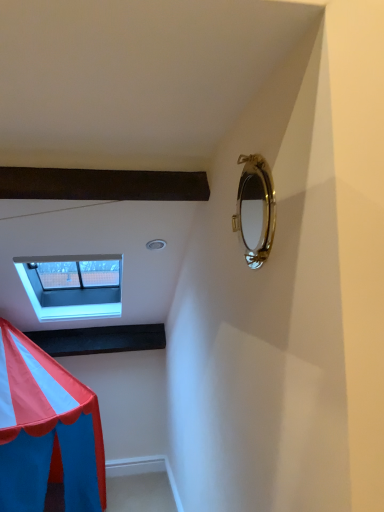
This screenshot has width=384, height=512. I want to click on white plastic window at upper left, so click(72, 286).

Describe the element at coordinates (72, 286) in the screenshot. I see `white plastic window at upper left` at that location.

What is the approximate height of white plastic window at upper left?

21.25 inches.

The image size is (384, 512). In order to click on gold metallic mirror at upper right in this screenshot , I will do `click(255, 209)`.

This screenshot has height=512, width=384. What do you see at coordinates (255, 209) in the screenshot?
I see `gold metallic mirror at upper right` at bounding box center [255, 209].

Locate an element on the screen. Image resolution: width=384 pixels, height=512 pixels. white plastic window at upper left is located at coordinates point(72,286).

Considering the positions of objects gold metallic mirror at upper right and white plastic window at upper left in the image provided, who is more to the right, gold metallic mirror at upper right or white plastic window at upper left?

From the viewer's perspective, gold metallic mirror at upper right appears more on the right side.

Is gold metallic mirror at upper right further to the viewer compared to white plastic window at upper left?

No, the depth of gold metallic mirror at upper right is less than that of white plastic window at upper left.

Does point (269, 220) lie behind point (64, 306)?

No, (269, 220) is in front of (64, 306).

From the image's perspective, is gold metallic mirror at upper right on top of white plastic window at upper left?

Yes, from the image's perspective, gold metallic mirror at upper right is over white plastic window at upper left.

From a real-world perspective, who is located lower, gold metallic mirror at upper right or white plastic window at upper left?

white plastic window at upper left.

Which object is thinner, gold metallic mirror at upper right or white plastic window at upper left?

gold metallic mirror at upper right is thinner.

Between gold metallic mirror at upper right and white plastic window at upper left, which one has less height?

gold metallic mirror at upper right is shorter.

Considering the relative sizes of gold metallic mirror at upper right and white plastic window at upper left in the image provided, is gold metallic mirror at upper right smaller than white plastic window at upper left?

Yes, gold metallic mirror at upper right is smaller than white plastic window at upper left.

Is gold metallic mirror at upper right inside or outside of white plastic window at upper left?

gold metallic mirror at upper right is located beyond the bounds of white plastic window at upper left.

Is there a large distance between gold metallic mirror at upper right and white plastic window at upper left?

gold metallic mirror at upper right is far away from white plastic window at upper left.

Is gold metallic mirror at upper right oriented towards white plastic window at upper left?

No.

The height and width of the screenshot is (512, 384). In order to click on mirror positioned vertically above the white plastic window at upper left (from a real-world perspective) in this screenshot , I will do `click(255, 209)`.

Which is more to the left, white plastic window at upper left or gold metallic mirror at upper right?

white plastic window at upper left.

Based on the photo, is white plastic window at upper left in front of or behind gold metallic mirror at upper right in the image?

Visually, white plastic window at upper left is located behind gold metallic mirror at upper right.

Considering the positions of points (47, 288) and (264, 201), is point (47, 288) closer to camera compared to point (264, 201)?

No, it is behind (264, 201).

From the image's perspective, is white plastic window at upper left located above or below gold metallic mirror at upper right?

white plastic window at upper left is below gold metallic mirror at upper right.

In the scene shown: From a real-world perspective, is white plastic window at upper left physically above gold metallic mirror at upper right?

Actually, white plastic window at upper left is physically below gold metallic mirror at upper right in the real world.

Which of these two, white plastic window at upper left or gold metallic mirror at upper right, is wider?

With larger width is white plastic window at upper left.

From their relative heights in the image, would you say white plastic window at upper left is taller or shorter than gold metallic mirror at upper right?

In the image, white plastic window at upper left appears to be taller than gold metallic mirror at upper right.

Does white plastic window at upper left have a smaller size compared to gold metallic mirror at upper right?

No, white plastic window at upper left is not smaller than gold metallic mirror at upper right.

Choose the correct answer: Is white plastic window at upper left inside gold metallic mirror at upper right or outside it?

white plastic window at upper left is located beyond the bounds of gold metallic mirror at upper right.

Is the surface of white plastic window at upper left in direct contact with gold metallic mirror at upper right?

They are not placed beside each other.

Could you tell me if white plastic window at upper left is facing gold metallic mirror at upper right?

Yes.

Where is `window that is behind the gold metallic mirror at upper right`? window that is behind the gold metallic mirror at upper right is located at coordinates (72, 286).

Where is `mirror above the white plastic window at upper left (from the image's perspective)`? Image resolution: width=384 pixels, height=512 pixels. mirror above the white plastic window at upper left (from the image's perspective) is located at coordinates (255, 209).

Find the location of `mirror positioned vertically above the white plastic window at upper left (from a real-world perspective)`. mirror positioned vertically above the white plastic window at upper left (from a real-world perspective) is located at coordinates (255, 209).